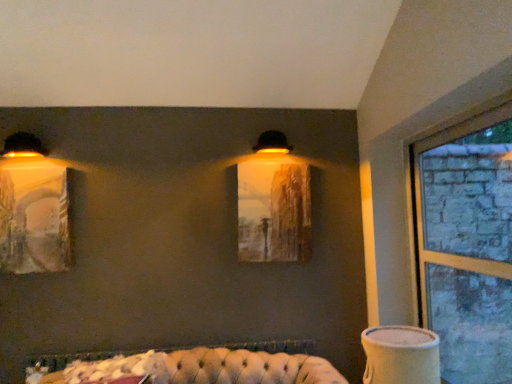
Question: Does clear glass window at right have a lesser height compared to matte glass painting at center?

Choices:
 (A) yes
 (B) no

Answer: (B)

Question: From the image's perspective, would you say clear glass window at right is positioned over matte glass painting at center?

Choices:
 (A) no
 (B) yes

Answer: (A)

Question: Is clear glass window at right bigger than matte glass painting at center?

Choices:
 (A) yes
 (B) no

Answer: (A)

Question: Is clear glass window at right in front of matte glass painting at center?

Choices:
 (A) no
 (B) yes

Answer: (B)

Question: Is clear glass window at right wider than matte glass painting at center?

Choices:
 (A) no
 (B) yes

Answer: (B)

Question: Is point (276, 150) positioned closer to the camera than point (256, 218)?

Choices:
 (A) closer
 (B) farther

Answer: (B)

Question: Looking at their shapes, would you say matte black lampshade at upper center, which appears as the 1th lamp when viewed from the top, is wider or thinner than matte glass painting at center?

Choices:
 (A) wide
 (B) thin

Answer: (A)

Question: Is matte black lampshade at upper center, marked as the 3th lamp in a left-to-right arrangement, bigger or smaller than matte glass painting at center?

Choices:
 (A) big
 (B) small

Answer: (B)

Question: Considering their positions, is matte black lampshade at upper center, which appears as the 1th lamp when viewed from the top, located in front of or behind matte glass painting at center?

Choices:
 (A) behind
 (B) front

Answer: (B)

Question: Does point pos(248,188) appear closer or farther from the camera than point pos(274,137)?

Choices:
 (A) farther
 (B) closer

Answer: (B)

Question: From their relative heights in the image, would you say matte glass painting at center is taller or shorter than matte black lampshade at upper center, arranged as the third lamp when ordered from the bottom?

Choices:
 (A) tall
 (B) short

Answer: (A)

Question: From the image's perspective, relative to matte black lampshade at upper center, arranged as the third lamp when ordered from the bottom, is matte glass painting at center above or below?

Choices:
 (A) below
 (B) above

Answer: (A)

Question: Considering their positions, is matte glass painting at center located in front of or behind matte black lampshade at upper center, arranged as the third lamp when ordered from the bottom?

Choices:
 (A) front
 (B) behind

Answer: (B)

Question: Is white ceramic vase at lower right in front of or behind matte yellow wall sconce at left, which appears as the third lamp when viewed from the right, in the image?

Choices:
 (A) front
 (B) behind

Answer: (A)

Question: Is point (431, 342) closer or farther from the camera than point (13, 134)?

Choices:
 (A) closer
 (B) farther

Answer: (A)